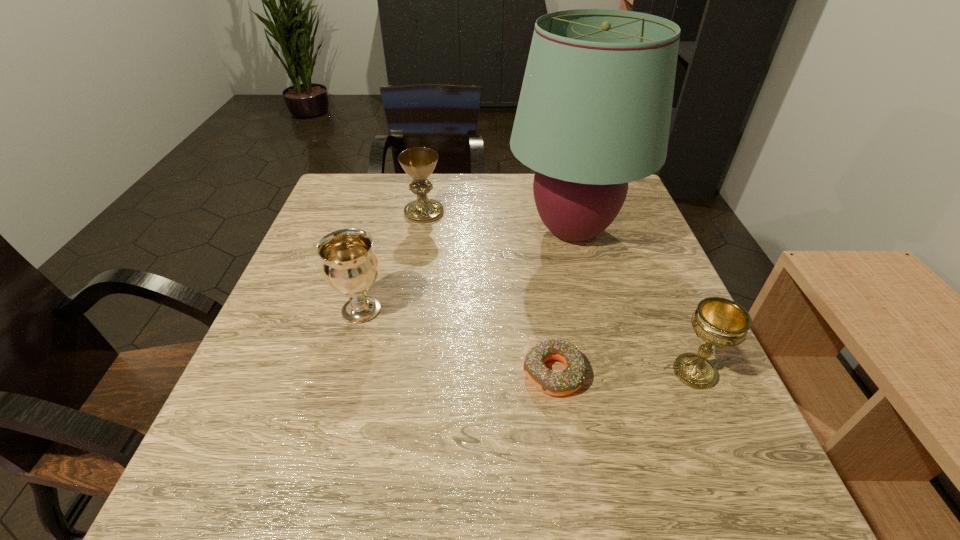
Locate an element on the screen. The width and height of the screenshot is (960, 540). lampshade located at the far edge is located at coordinates (594, 112).

The width and height of the screenshot is (960, 540). In order to click on chalice that is positioned at the far edge in this screenshot , I will do tap(419, 162).

What are the coordinates of `object that is at the left edge` in the screenshot? It's located at (350, 267).

The width and height of the screenshot is (960, 540). I want to click on lampshade present at the right edge, so click(594, 112).

At what (x,y) coordinates should I click in order to perform the action: click on chalice located at the right edge. Please return your answer as a coordinate pair (x, y). The image size is (960, 540). Looking at the image, I should click on (720, 322).

This screenshot has width=960, height=540. Identify the location of object located in the far right corner section of the desktop. (594, 112).

In the image, there is a desktop. At what (x,y) coordinates should I click in order to perform the action: click on vacant space at the far edge. Please return your answer as a coordinate pair (x, y). The image size is (960, 540). Looking at the image, I should click on (472, 199).

The width and height of the screenshot is (960, 540). In the image, there is a desktop. Find the location of `vacant space at the left edge`. vacant space at the left edge is located at coordinates (252, 349).

Where is `vacant space at the right edge of the desktop`? This screenshot has width=960, height=540. vacant space at the right edge of the desktop is located at coordinates (636, 230).

Where is `vacant space at the far left corner`? Image resolution: width=960 pixels, height=540 pixels. vacant space at the far left corner is located at coordinates point(365,192).